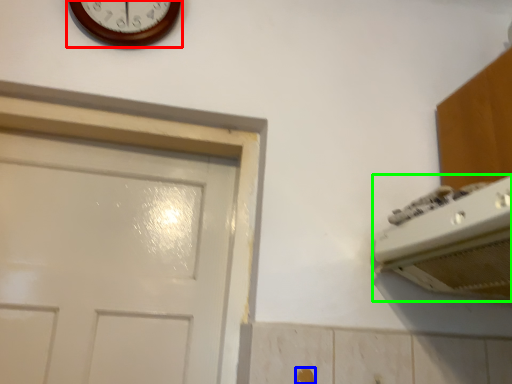
Question: Which object is the closest to the wall clock (highlighted by a red box)? Choose among these: door handle (highlighted by a blue box) or appliance (highlighted by a green box).

Choices:
 (A) door handle
 (B) appliance

Answer: (B)